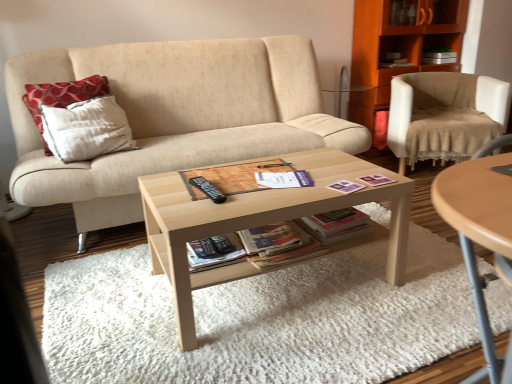
Image resolution: width=512 pixels, height=384 pixels. In order to click on free spot to the left of light wood/texture coffee table at center in this screenshot , I will do `click(110, 309)`.